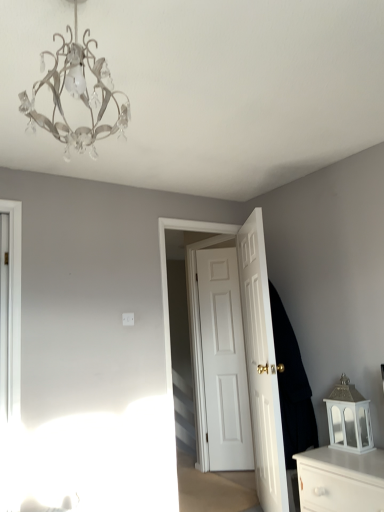
Question: Can you confirm if white glossy chest of drawers at lower right is shorter than white glossy door at center, the 3th door positioned from the back?

Choices:
 (A) yes
 (B) no

Answer: (A)

Question: Does white glossy chest of drawers at lower right have a greater width compared to white glossy door at center, the first door in the front-to-back sequence?

Choices:
 (A) no
 (B) yes

Answer: (B)

Question: Is the depth of white glossy chest of drawers at lower right greater than that of white glossy door at center, the first door in the front-to-back sequence?

Choices:
 (A) yes
 (B) no

Answer: (B)

Question: Is white glossy chest of drawers at lower right beside white glossy door at center, the 3th door positioned from the back?

Choices:
 (A) no
 (B) yes

Answer: (A)

Question: Is white glossy chest of drawers at lower right turned away from white glossy door at center, the first door in the front-to-back sequence?

Choices:
 (A) yes
 (B) no

Answer: (B)

Question: Is white glossy chest of drawers at lower right to the left or to the right of dark matte coat at right in the image?

Choices:
 (A) left
 (B) right

Answer: (B)

Question: From the image's perspective, is white glossy chest of drawers at lower right above or below dark matte coat at right?

Choices:
 (A) below
 (B) above

Answer: (A)

Question: Looking at their shapes, would you say white glossy chest of drawers at lower right is wider or thinner than dark matte coat at right?

Choices:
 (A) thin
 (B) wide

Answer: (B)

Question: From a real-world perspective, is white glossy chest of drawers at lower right physically located above or below dark matte coat at right?

Choices:
 (A) below
 (B) above

Answer: (A)

Question: From the image's perspective, relative to dark matte coat at right, is white matte door at center, the 1th door viewed from the back, above or below?

Choices:
 (A) above
 (B) below

Answer: (B)

Question: From a real-world perspective, is white matte door at center, the 1th door viewed from the back, above or below dark matte coat at right?

Choices:
 (A) below
 (B) above

Answer: (A)

Question: Is white matte door at center, the 1th door viewed from the back, taller or shorter than dark matte coat at right?

Choices:
 (A) tall
 (B) short

Answer: (A)

Question: Considering the relative positions of white matte door at center, the 1th door viewed from the back, and dark matte coat at right in the image provided, is white matte door at center, the 1th door viewed from the back, to the left or to the right of dark matte coat at right?

Choices:
 (A) left
 (B) right

Answer: (A)

Question: Visually, is white glossy door at center, the first door in the front-to-back sequence, positioned to the left or to the right of white glossy chest of drawers at lower right?

Choices:
 (A) left
 (B) right

Answer: (A)

Question: From the image's perspective, is white glossy door at center, the 3th door positioned from the back, located above or below white glossy chest of drawers at lower right?

Choices:
 (A) above
 (B) below

Answer: (A)